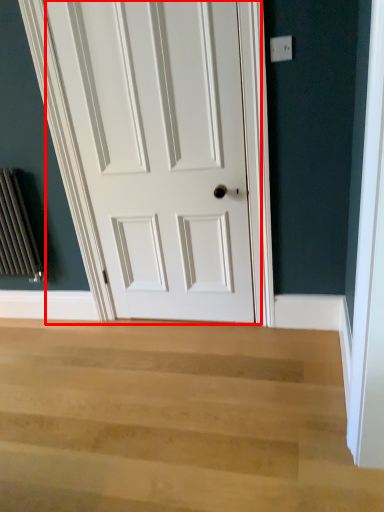
Question: From the image's perspective, what is the correct spatial relationship of door (annotated by the red box) in relation to stairwell?

Choices:
 (A) below
 (B) above

Answer: (B)